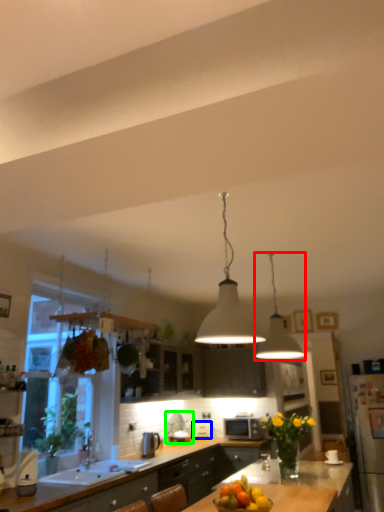
Question: Which is farther away from lamp (highlighted by a red box)? appliance (highlighted by a blue box) or appliance (highlighted by a green box)?

Choices:
 (A) appliance
 (B) appliance

Answer: (A)